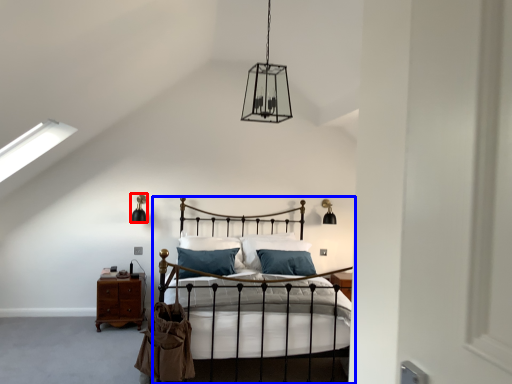
Question: Among these objects, which one is nearest to the camera, light fixture (highlighted by a red box) or bed (highlighted by a blue box)?

Choices:
 (A) light fixture
 (B) bed

Answer: (B)